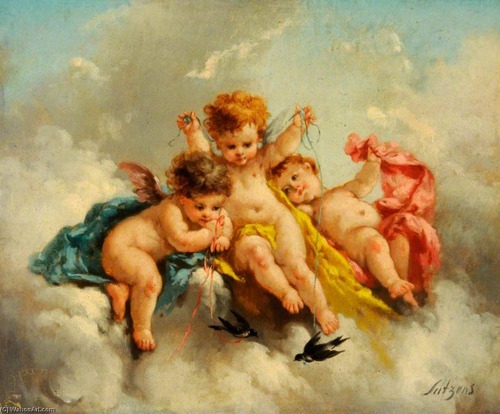
You are a GUI agent. You are given a task and a screenshot of the screen. Output one action in this format:
    pyautogui.click(x=<x>, y=<y>)
    Task: Click on the blue cloth
    
    Given the screenshot: What is the action you would take?
    pyautogui.click(x=77, y=230)